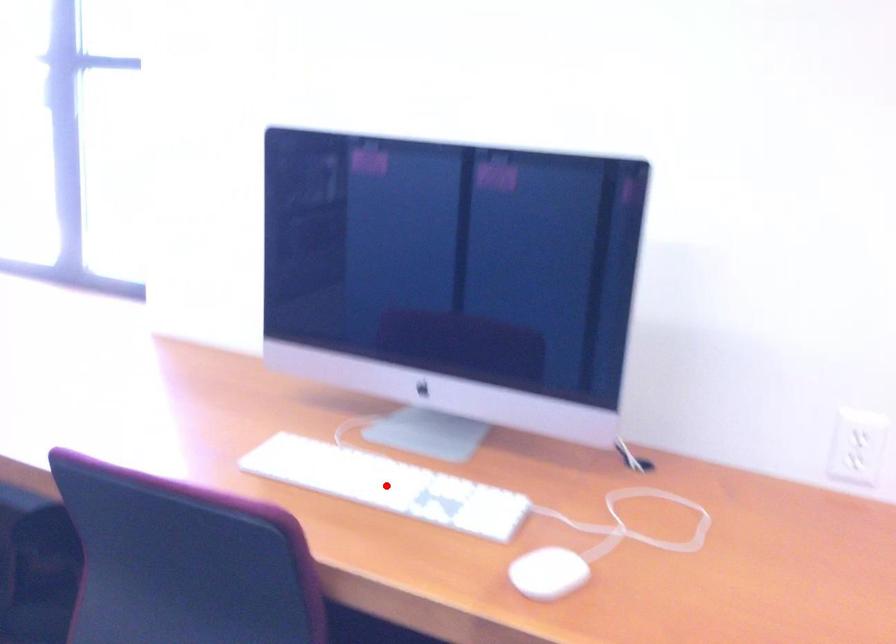
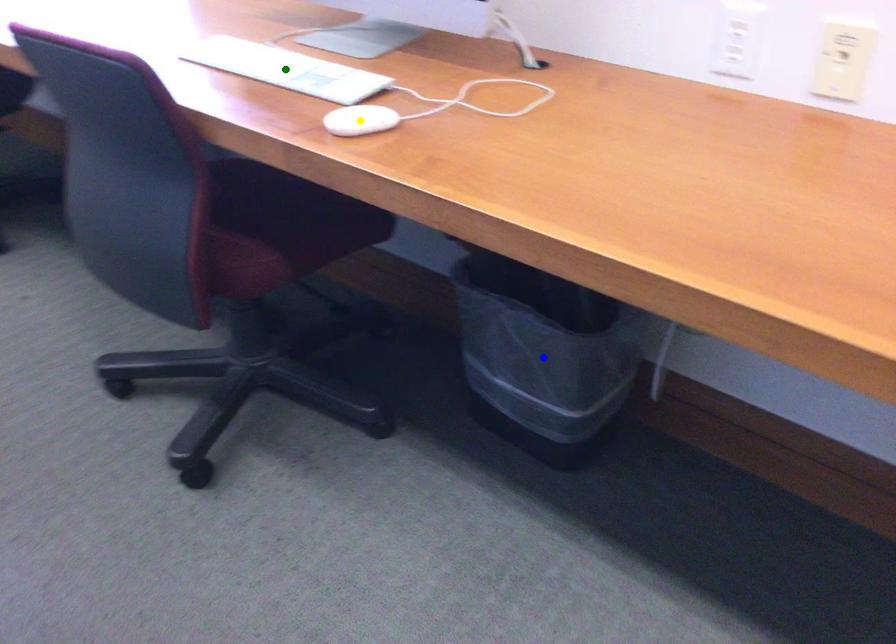
Question: I am providing you with two images of the same scene from different viewpoints. A red point is marked on the first image. You are given multiple points on the second image. Which point in image 2 represents the same 3d spot as the red point in image 1?

Choices:
 (A) green point
 (B) blue point
 (C) yellow point

Answer: (A)